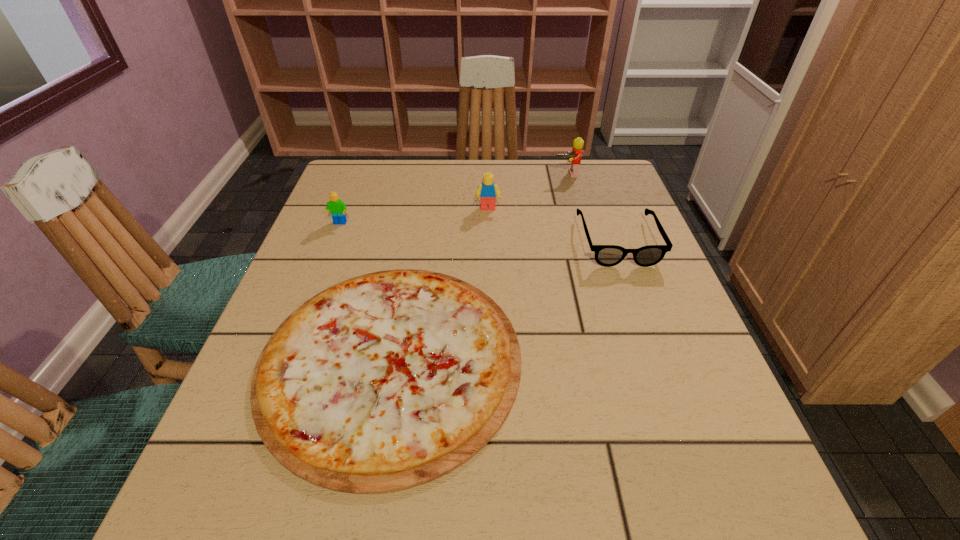
Image resolution: width=960 pixels, height=540 pixels. What are the coordinates of `free spot between the spectacles and the fourth nearest object` in the screenshot? It's located at (553, 225).

At what (x,y) coordinates should I click in order to perform the action: click on empty location between the second shortest object and the second farthest Lego. Please return your answer as a coordinate pair (x, y). This screenshot has height=540, width=960. Looking at the image, I should click on (553, 225).

In order to click on vacant space that is in between the second Lego from left to right and the rightmost Lego in this screenshot , I will do `click(527, 191)`.

I want to click on free point between the leftmost Lego and the fourth nearest object, so click(x=414, y=216).

Find the location of a particular element. the second closest object relative to the third shortest object is located at coordinates (488, 191).

This screenshot has width=960, height=540. Identify the location of the fourth closest object relative to the pizza. (574, 157).

The height and width of the screenshot is (540, 960). Identify the location of the third closest Lego to the shortest object. (574, 157).

Locate which Lego ranks in proximity to the shortest Lego. Please provide its 2D coordinates. Your answer should be formatted as a tuple, i.e. [(x, y)], where the tuple contains the x and y coordinates of a point satisfying the conditions above.

[(488, 191)]

Locate an element on the screen. The height and width of the screenshot is (540, 960). free space that satisfies the following two spatial constraints: 1. on the face of the pizza; 2. on the left side of the nearest Lego is located at coordinates (287, 360).

Locate an element on the screen. vacant region that satisfies the following two spatial constraints: 1. on the face of the pizza; 2. on the right side of the nearest Lego is located at coordinates (287, 360).